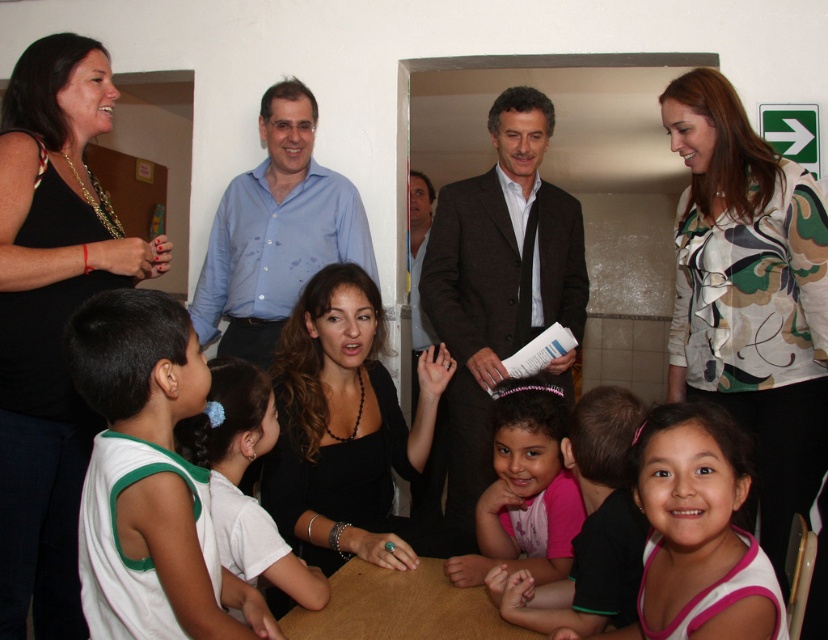
Consider the image. You are standing in the room where the dark brown suit at center and the black matte shirt at center are located. Which object is closer to you?

The dark brown suit at center is closer to you because the black matte shirt at center is behind it.

You are organizing a small event and need to decide which object to place a heavy decoration on. Based on the scene description, which object between the black fabric at upper left and the brown wooden table at center would be more suitable for supporting the weight?

The brown wooden table at center is more suitable for supporting the weight because the black fabric at upper left is thinner and likely less sturdy compared to the table.

What object is located at the coordinates point (277,232)?

The point (277,232) is located on the blue shirt at center.